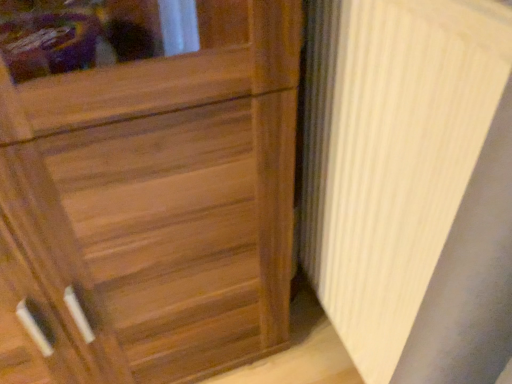
Where is `white ribbed radiator at right`? The image size is (512, 384). white ribbed radiator at right is located at coordinates pyautogui.click(x=391, y=155).

Describe the element at coordinates (391, 155) in the screenshot. I see `white ribbed radiator at right` at that location.

You are a GUI agent. You are given a task and a screenshot of the screen. Output one action in this format:
    pyautogui.click(x=<x>, y=<y>)
    Task: Click on the white ribbed radiator at right
    The height and width of the screenshot is (384, 512).
    Given the screenshot: What is the action you would take?
    pyautogui.click(x=391, y=155)